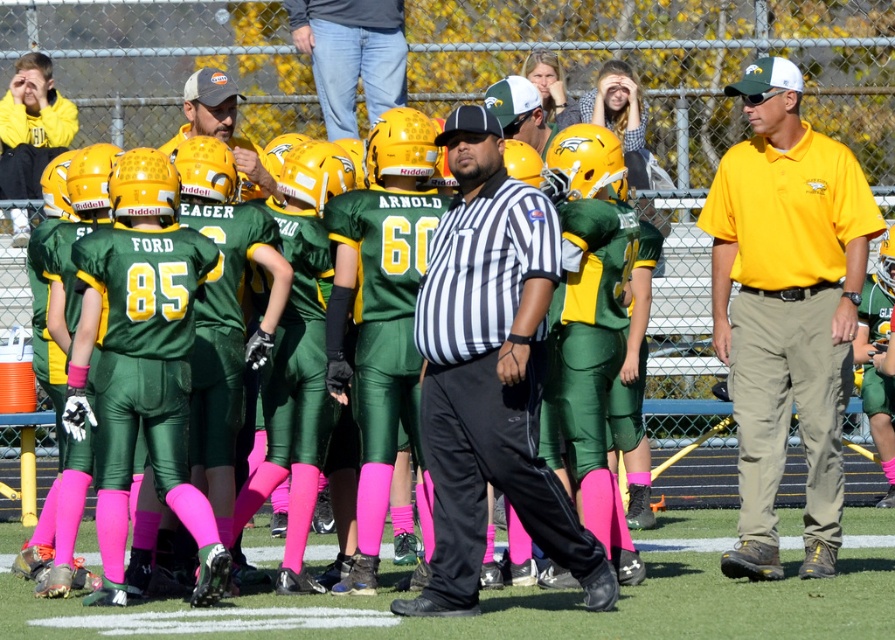
Question: Estimate the real-world distances between objects in this image. Which object is closer to the pink fabric socks at lower center?

Choices:
 (A) yellow cotton shirt at center
 (B) matte yellow helmet at upper left
 (C) green matte uniform at center

Answer: (A)

Question: Which point appears farthest from the camera in this image?

Choices:
 (A) (270, 176)
 (B) (842, 358)
 (C) (50, 70)
 (D) (507, 177)

Answer: (C)

Question: Estimate the real-world distances between objects in this image. Which object is closer to the matte yellow helmet at upper left?

Choices:
 (A) matte gray cap at center
 (B) green matte uniform at center
 (C) black striped shirt at center

Answer: (A)

Question: Does black striped shirt at center appear on the left side of matte yellow helmet at upper left?

Choices:
 (A) no
 (B) yes

Answer: (A)

Question: Considering the relative positions of green matte uniform at center and yellow cotton shirt at center in the image provided, where is green matte uniform at center located with respect to yellow cotton shirt at center?

Choices:
 (A) right
 (B) left

Answer: (B)

Question: Is black striped shirt at center above matte gray cap at center?

Choices:
 (A) no
 (B) yes

Answer: (A)